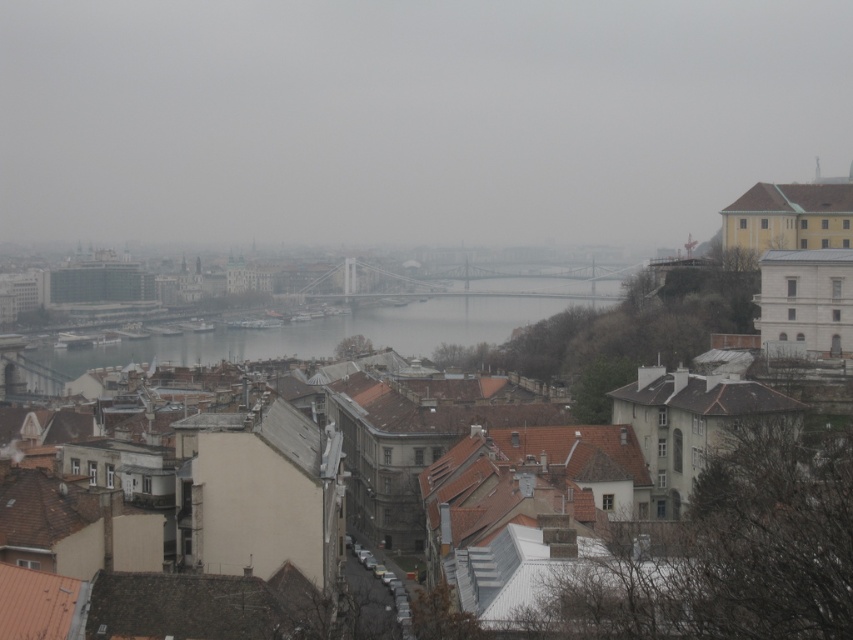
How far apart are brown tiled roofs at center and gray concrete water at center?

brown tiled roofs at center is 226.28 meters away from gray concrete water at center.

Describe the element at coordinates (735, 529) in the screenshot. I see `brown tiled roofs at center` at that location.

Image resolution: width=853 pixels, height=640 pixels. Find the location of `brown tiled roofs at center`. brown tiled roofs at center is located at coordinates (735, 529).